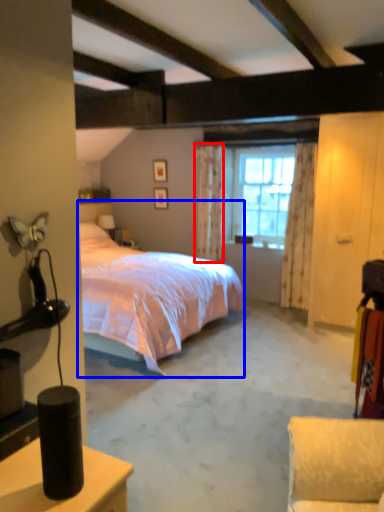
Question: Which point is further to the camera, curtain (highlighted by a red box) or bed (highlighted by a blue box)?

Choices:
 (A) curtain
 (B) bed

Answer: (A)